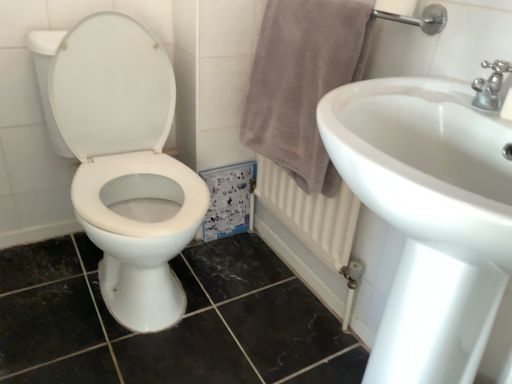
Question: From a real-world perspective, is white glossy toilet at left under silver metallic faucet at upper right?

Choices:
 (A) no
 (B) yes

Answer: (B)

Question: Can you confirm if white glossy toilet at left is positioned to the right of silver metallic faucet at upper right?

Choices:
 (A) no
 (B) yes

Answer: (A)

Question: Does white glossy toilet at left have a larger size compared to silver metallic faucet at upper right?

Choices:
 (A) yes
 (B) no

Answer: (A)

Question: Is white glossy toilet at left to the left of silver metallic faucet at upper right from the viewer's perspective?

Choices:
 (A) yes
 (B) no

Answer: (A)

Question: Considering the relative sizes of white glossy toilet at left and silver metallic faucet at upper right in the image provided, is white glossy toilet at left taller than silver metallic faucet at upper right?

Choices:
 (A) yes
 (B) no

Answer: (A)

Question: From the image's perspective, is white glossy toilet at left beneath silver metallic faucet at upper right?

Choices:
 (A) yes
 (B) no

Answer: (A)

Question: Is light gray plush towel at right surrounded by white glossy toilet at left?

Choices:
 (A) yes
 (B) no

Answer: (B)

Question: Is white glossy toilet at left completely or partially outside of light gray plush towel at right?

Choices:
 (A) no
 (B) yes

Answer: (B)

Question: Are white glossy toilet at left and light gray plush towel at right making contact?

Choices:
 (A) yes
 (B) no

Answer: (B)

Question: From a real-world perspective, is white glossy toilet at left physically above light gray plush towel at right?

Choices:
 (A) yes
 (B) no

Answer: (B)

Question: Does white glossy toilet at left have a lesser height compared to light gray plush towel at right?

Choices:
 (A) yes
 (B) no

Answer: (B)

Question: Is white glossy toilet at left thinner than light gray plush towel at right?

Choices:
 (A) no
 (B) yes

Answer: (A)

Question: Does silver metallic faucet at upper right appear on the left side of light gray plush towel at right?

Choices:
 (A) no
 (B) yes

Answer: (A)